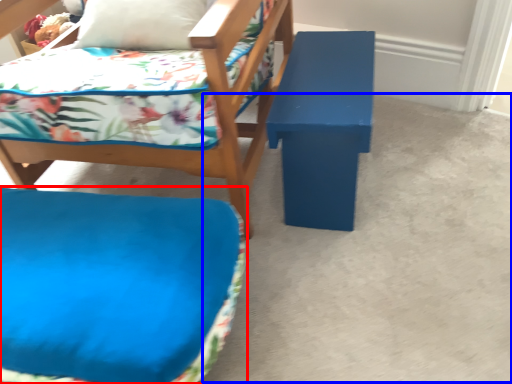
Question: Which object appears closest to the camera in this image, furniture (highlighted by a red box) or concrete (highlighted by a blue box)?

Choices:
 (A) furniture
 (B) concrete

Answer: (A)